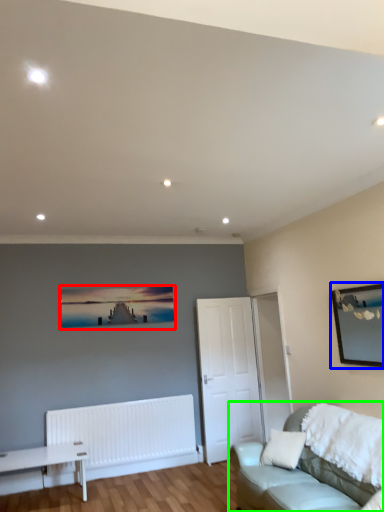
Question: Which object is the closest to the picture frame (highlighted by a red box)? Choose among these: picture frame (highlighted by a blue box) or studio couch (highlighted by a green box).

Choices:
 (A) picture frame
 (B) studio couch

Answer: (B)